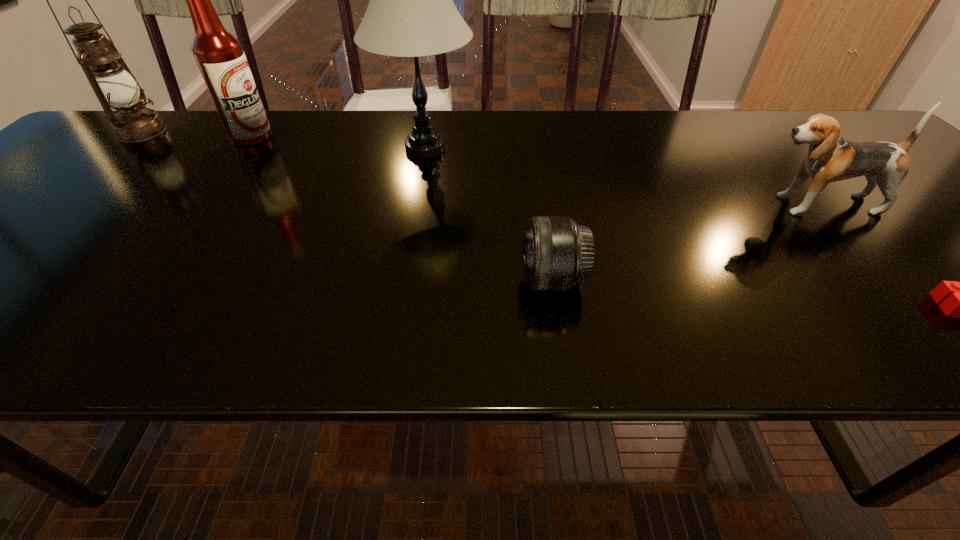
The width and height of the screenshot is (960, 540). What are the coordinates of `object located in the far left corner section of the desktop` in the screenshot? It's located at (115, 86).

At what (x,y) coordinates should I click in order to perform the action: click on free region at the far edge. Please return your answer as a coordinate pair (x, y). The width and height of the screenshot is (960, 540). Looking at the image, I should click on (464, 115).

Find the location of a particular element. The width and height of the screenshot is (960, 540). vacant area at the left edge is located at coordinates (85, 176).

Locate an element on the screen. Image resolution: width=960 pixels, height=540 pixels. vacant space at the far right corner of the desktop is located at coordinates (843, 118).

You are a GUI agent. You are given a task and a screenshot of the screen. Output one action in this format:
    pyautogui.click(x=<x>, y=<y>)
    Task: Click on the unoccupied position between the leftmost object and the alcohol
    This screenshot has width=960, height=540.
    Given the screenshot: What is the action you would take?
    pyautogui.click(x=197, y=134)

Find the location of a particular element. Image resolution: width=960 pixels, height=540 pixels. vacant area that lies between the telephoto lens and the puppy is located at coordinates (684, 242).

This screenshot has width=960, height=540. What are the coordinates of `free point between the lamp and the second object from left to right` in the screenshot? It's located at (338, 143).

The image size is (960, 540). I want to click on free space between the oil lamp and the telephoto lens, so click(347, 205).

You are a GUI agent. You are given a task and a screenshot of the screen. Output one action in this format:
    pyautogui.click(x=<x>, y=<y>)
    Task: Click on the free space between the lamp and the fourth farthest object
    
    Given the screenshot: What is the action you would take?
    pyautogui.click(x=620, y=177)

You are a GUI agent. You are given a task and a screenshot of the screen. Output one action in this format:
    pyautogui.click(x=<x>, y=<y>)
    Task: Click on the free point between the fourth object from left to right and the fifth object from right to left
    
    Given the screenshot: What is the action you would take?
    pyautogui.click(x=402, y=208)